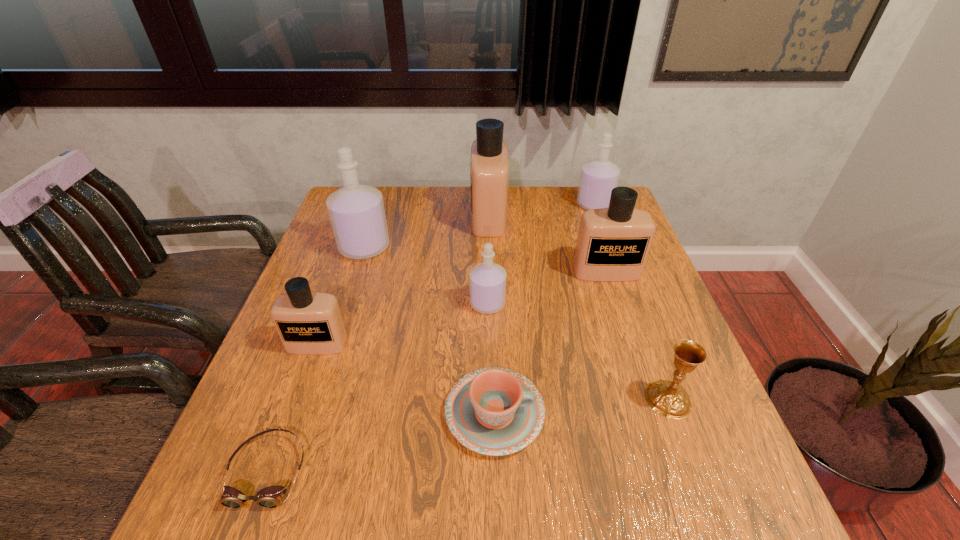
This screenshot has height=540, width=960. In order to click on free space located on the front of the leftmost purple perfume in this screenshot , I will do coord(336,334).

Find the location of `blank area located on the front of the second biggest purple perfume`. blank area located on the front of the second biggest purple perfume is located at coordinates (602, 225).

Locate an element on the screen. Image resolution: width=960 pixels, height=540 pixels. vacant space located on the front label of the second smallest beige perfume is located at coordinates (631, 344).

This screenshot has width=960, height=540. In order to click on vacant area located 0.220m on the right of the fifth farthest perfume in this screenshot , I will do `click(594, 303)`.

In order to click on vacant space located on the front label of the nearest perfume in this screenshot , I will do `click(288, 426)`.

Identify the location of free space located on the back of the third shortest object. This screenshot has height=540, width=960. pos(616,260).

Where is `free space located 0.220m on the handle side of the pink chinaware`? The width and height of the screenshot is (960, 540). free space located 0.220m on the handle side of the pink chinaware is located at coordinates (657, 413).

Locate an element on the screen. The height and width of the screenshot is (540, 960). object that is at the near edge is located at coordinates (270, 497).

The height and width of the screenshot is (540, 960). In order to click on goggles present at the left edge in this screenshot , I will do `click(270, 497)`.

The height and width of the screenshot is (540, 960). I want to click on chalice that is at the right edge, so click(669, 398).